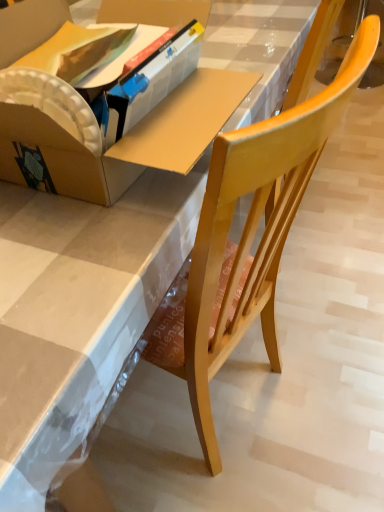
Question: From the image's perspective, does matte cardboard box at center appear lower than wooden chair at center?

Choices:
 (A) no
 (B) yes

Answer: (A)

Question: From a real-world perspective, is matte cardboard box at center physically above wooden chair at center?

Choices:
 (A) no
 (B) yes

Answer: (B)

Question: Could you tell me if matte cardboard box at center is facing wooden chair at center?

Choices:
 (A) no
 (B) yes

Answer: (A)

Question: Is matte cardboard box at center closer to the viewer compared to wooden chair at center?

Choices:
 (A) yes
 (B) no

Answer: (B)

Question: Does matte cardboard box at center have a smaller size compared to wooden chair at center?

Choices:
 (A) yes
 (B) no

Answer: (A)

Question: Is wooden chair at center inside matte cardboard box at center?

Choices:
 (A) no
 (B) yes

Answer: (A)

Question: From the image's perspective, is wooden chair at center located beneath matte cardboard box at center?

Choices:
 (A) yes
 (B) no

Answer: (A)

Question: Could you tell me if wooden chair at center is turned towards matte cardboard box at center?

Choices:
 (A) no
 (B) yes

Answer: (B)

Question: From a real-world perspective, is wooden chair at center below matte cardboard box at center?

Choices:
 (A) yes
 (B) no

Answer: (A)

Question: Is matte cardboard box at center surrounded by wooden chair at center?

Choices:
 (A) yes
 (B) no

Answer: (A)

Question: Is wooden chair at center touching matte cardboard box at center?

Choices:
 (A) yes
 (B) no

Answer: (B)

Question: Does wooden chair at center have a smaller size compared to matte cardboard box at center?

Choices:
 (A) yes
 (B) no

Answer: (B)

Question: Considering the positions of matte cardboard box at center and wooden chair at center in the image, is matte cardboard box at center taller or shorter than wooden chair at center?

Choices:
 (A) short
 (B) tall

Answer: (A)